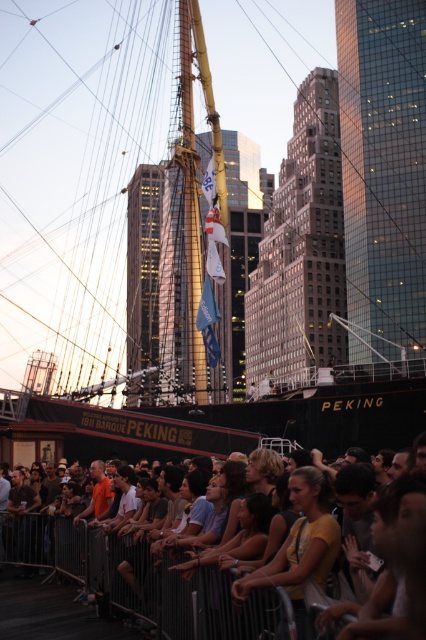
Can you confirm if black matte ship at center is taller than matte yellow shirt at center?

Yes, black matte ship at center is taller than matte yellow shirt at center.

Is point (66, 308) in front of point (74, 531)?

No, (66, 308) is further to viewer.

Find the location of `black matte ship at center`. black matte ship at center is located at coordinates (74, 172).